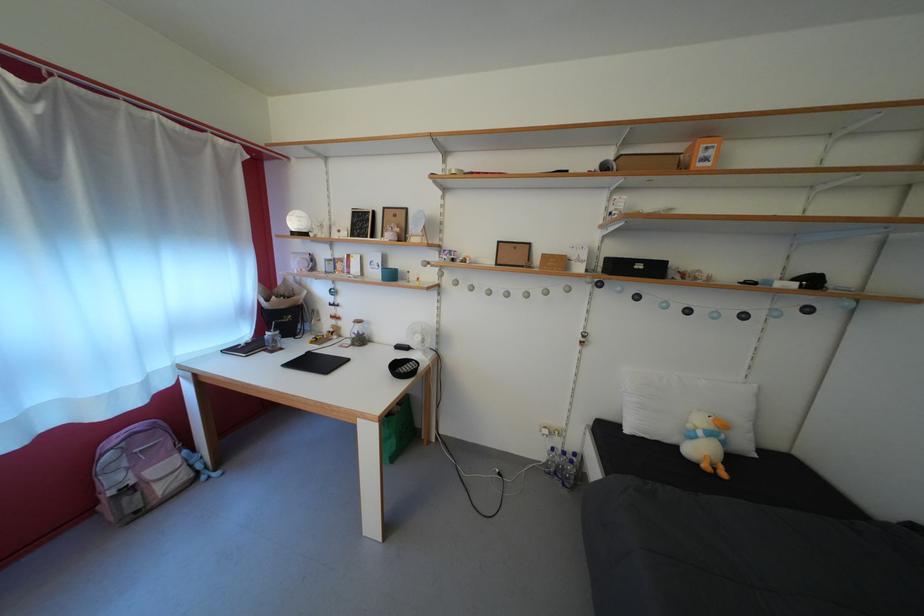
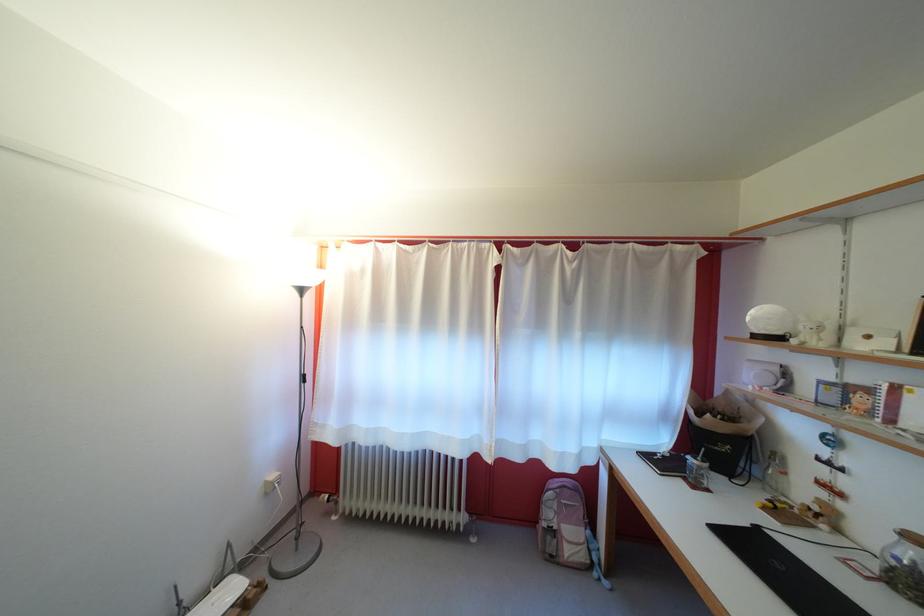
Question: The camera is either moving clockwise (left) or counter-clockwise (right) around the object. The first image is from the beginning of the video and the second image is from the end. Is the camera moving left or right when shooting the video?

Choices:
 (A) Left
 (B) Right

Answer: (B)